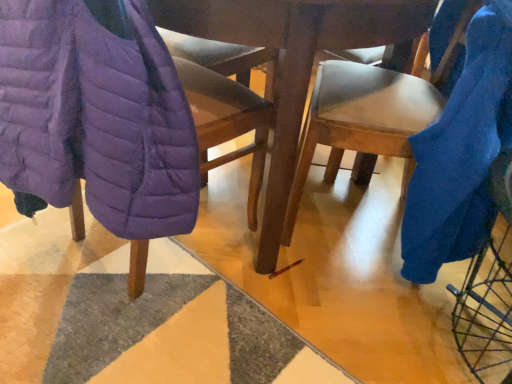
You are a GUI agent. You are given a task and a screenshot of the screen. Output one action in this format:
    pyautogui.click(x=<x>, y=<y>)
    Task: Click on the free location in front of blue fabric chair at right, positioned as the 2th chair in left-to-right order
    
    Given the screenshot: What is the action you would take?
    pyautogui.click(x=324, y=311)